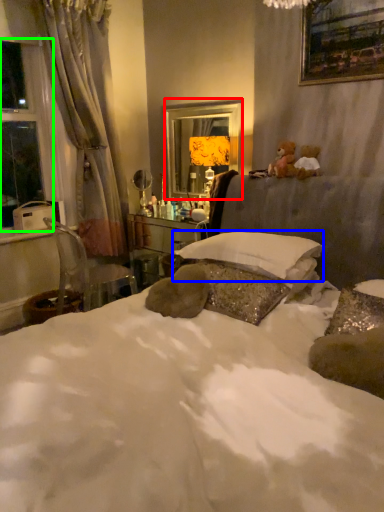
Question: Based on their relative distances, which object is farther from mirror (highlighted by a red box)? Choose from pillow (highlighted by a blue box) and window (highlighted by a green box).

Choices:
 (A) pillow
 (B) window

Answer: (B)